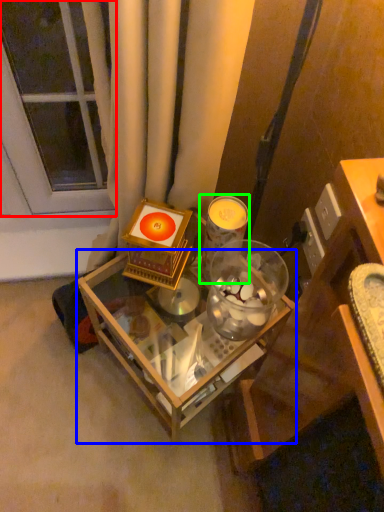
Question: Which is farther away from glass door (highlighted by a red box)? table (highlighted by a blue box) or candle holder (highlighted by a green box)?

Choices:
 (A) table
 (B) candle holder

Answer: (A)